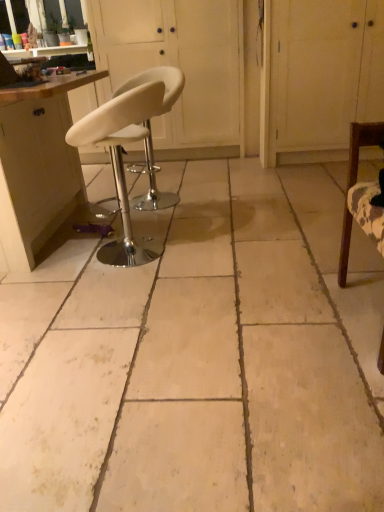
Where is `vacant region below wooden chair at right, arranged as the 1th chair when viewed from the right (from a real-world perspective)`? The width and height of the screenshot is (384, 512). vacant region below wooden chair at right, arranged as the 1th chair when viewed from the right (from a real-world perspective) is located at coordinates (369, 312).